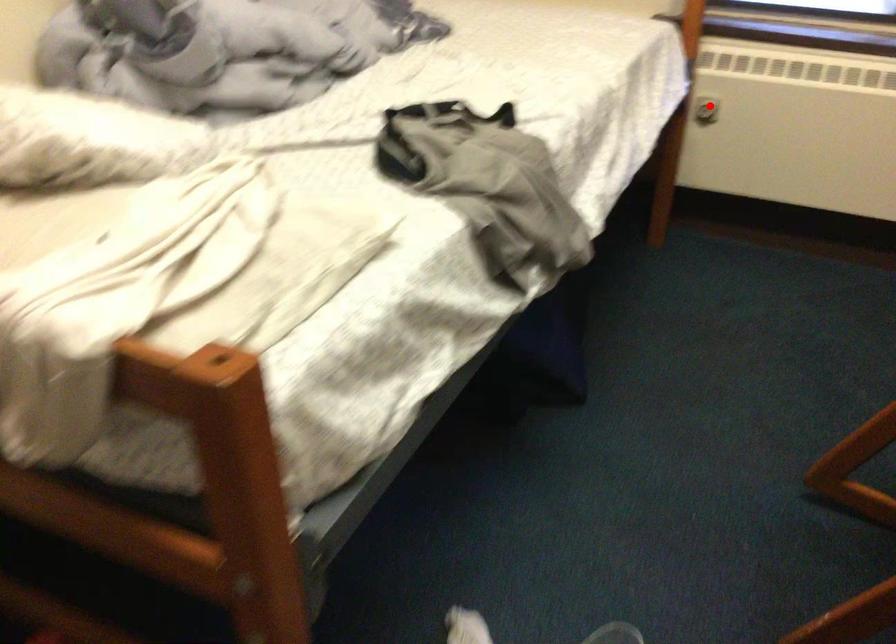
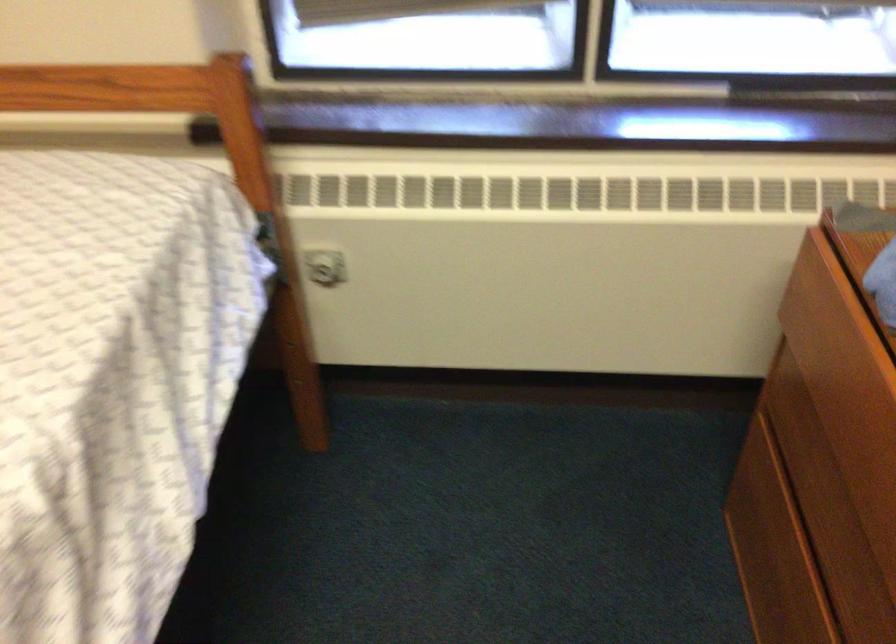
Where in the second image is the point corresponding to the highlighted location from the first image?

(323, 267)